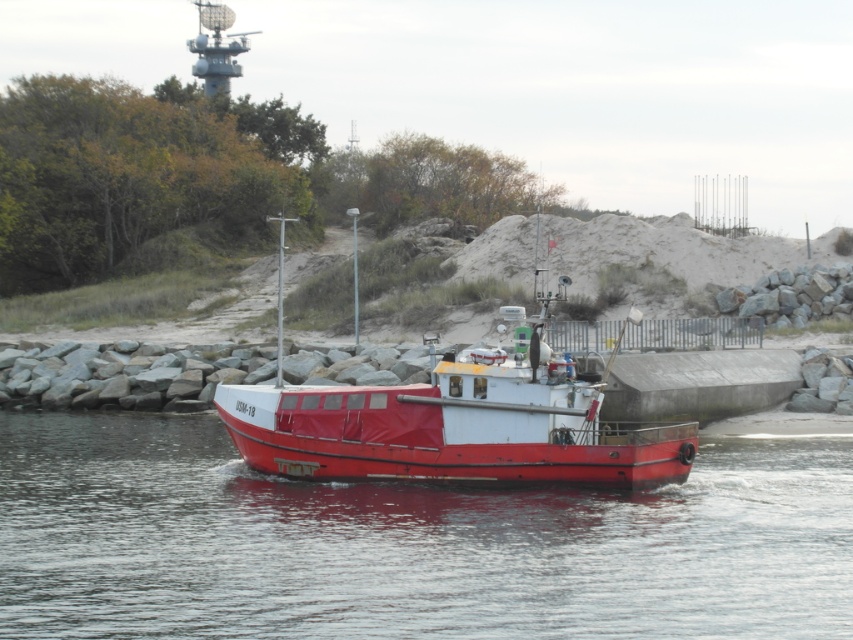
You are a sailor on the red matte boat at center. You notice the smooth water at boat center. Which object is larger in size?

The red matte boat at center is larger than the smooth water at boat center.

In the scene shown: You are a sailor on the red matte boat at center. You want to check the water condition below your current position. According to the scene, where exactly is the smooth water at boat center located?

The smooth water at boat center is located below the red matte boat at center, so you can look directly downward from your position on the boat to see it.

You are a sailor on the USM 18 boat and you want to know where the smooth water is located. Please provide the coordinates of the smooth water at boat center in the image.

The smooth water at boat center is located at point (405, 545).